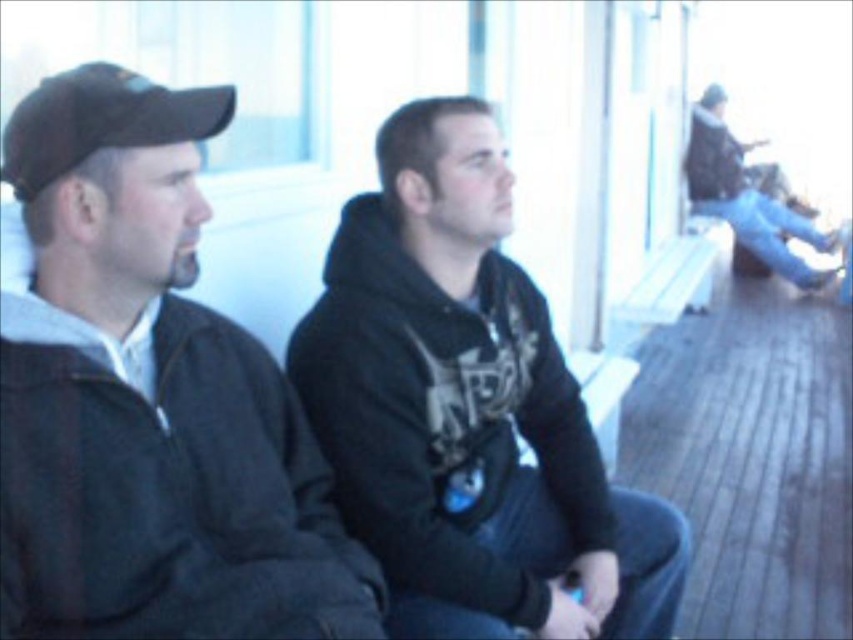
Question: Which object is positioned closest to the dark gray jacket at left?

Choices:
 (A) black matte hoodie at center
 (B) black matte baseball cap at left

Answer: (B)

Question: Does black matte hoodie at center appear over dark gray hoodie at upper right?

Choices:
 (A) yes
 (B) no

Answer: (B)

Question: Considering the relative positions of black matte hoodie at center and black matte baseball cap at left in the image provided, where is black matte hoodie at center located with respect to black matte baseball cap at left?

Choices:
 (A) right
 (B) left

Answer: (A)

Question: Based on their relative distances, which object is nearer to the black matte hoodie at center?

Choices:
 (A) dark gray jacket at left
 (B) black matte baseball cap at left
 (C) dark gray hoodie at upper right

Answer: (A)

Question: Is dark gray jacket at left bigger than dark gray hoodie at upper right?

Choices:
 (A) yes
 (B) no

Answer: (B)

Question: Which point is closer to the camera taking this photo?

Choices:
 (A) (761, 216)
 (B) (198, 531)
 (C) (544, 321)
 (D) (16, 148)

Answer: (D)